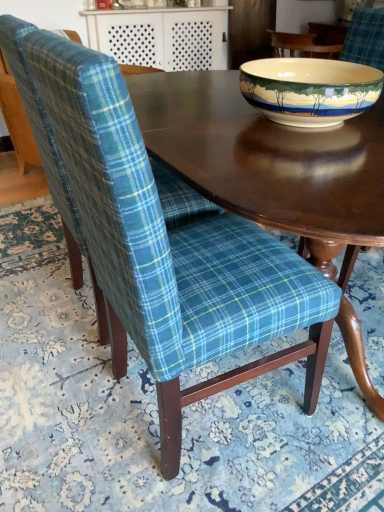
The image size is (384, 512). What are the coordinates of `smooth dark wood table at upper center` in the screenshot? It's located at (162, 37).

This screenshot has width=384, height=512. What do you see at coordinates (309, 90) in the screenshot?
I see `porcelain bowl at upper right` at bounding box center [309, 90].

Find the location of a particular element. teal plaid fabric chair at center, marked as the first chair in a front-to-back arrangement is located at coordinates (170, 251).

Based on the photo, is teal plaid fabric chair at center, marked as the first chair in a front-to-back arrangement, taller or shorter than smooth dark wood table at upper center?

Considering their sizes, teal plaid fabric chair at center, marked as the first chair in a front-to-back arrangement, has more height than smooth dark wood table at upper center.

Considering the sizes of teal plaid fabric chair at center, marked as the first chair in a front-to-back arrangement, and smooth dark wood table at upper center in the image, is teal plaid fabric chair at center, marked as the first chair in a front-to-back arrangement, wider or thinner than smooth dark wood table at upper center?

Clearly, teal plaid fabric chair at center, marked as the first chair in a front-to-back arrangement, has more width compared to smooth dark wood table at upper center.

Can you confirm if teal plaid fabric chair at center, the second chair in the back-to-front sequence, is positioned to the left of smooth dark wood table at upper center?

Incorrect, teal plaid fabric chair at center, the second chair in the back-to-front sequence, is not on the left side of smooth dark wood table at upper center.

Is porcelain bowl at upper right closer to the viewer compared to blue plaid fabric chair at left, the 1th chair positioned from the back?

No, it is behind blue plaid fabric chair at left, the 1th chair positioned from the back.

Is porcelain bowl at upper right not within blue plaid fabric chair at left, the second chair positioned from the front?

Yes, porcelain bowl at upper right is not within blue plaid fabric chair at left, the second chair positioned from the front.

Is porcelain bowl at upper right at the left side of blue plaid fabric chair at left, the 1th chair positioned from the back?

No.

Between point (285, 86) and point (70, 198), which one is positioned behind?

The point (70, 198) is farther from the camera.

Would you say smooth dark wood table at upper center is a long distance from porcelain bowl at upper right?

smooth dark wood table at upper center is positioned a significant distance from porcelain bowl at upper right.

Does smooth dark wood table at upper center contain porcelain bowl at upper right?

No, porcelain bowl at upper right is not surrounded by smooth dark wood table at upper center.

Which object is more forward, smooth dark wood table at upper center or porcelain bowl at upper right?

porcelain bowl at upper right is more forward.

From a real-world perspective, between blue plaid fabric chair at left, the 1th chair positioned from the back, and teal plaid fabric chair at center, marked as the first chair in a front-to-back arrangement, who is vertically higher?

From a 3D spatial view, teal plaid fabric chair at center, marked as the first chair in a front-to-back arrangement, is above.

Between blue plaid fabric chair at left, the 1th chair positioned from the back, and teal plaid fabric chair at center, the second chair in the back-to-front sequence, which one has less height?

With less height is teal plaid fabric chair at center, the second chair in the back-to-front sequence.

Is blue plaid fabric chair at left, the 1th chair positioned from the back, outside of teal plaid fabric chair at center, the second chair in the back-to-front sequence?

Yes, blue plaid fabric chair at left, the 1th chair positioned from the back, is outside of teal plaid fabric chair at center, the second chair in the back-to-front sequence.

Between blue plaid fabric chair at left, the 1th chair positioned from the back, and teal plaid fabric chair at center, the second chair in the back-to-front sequence, which one has smaller size?

teal plaid fabric chair at center, the second chair in the back-to-front sequence.

Considering the relative sizes of smooth dark wood table at upper center and teal plaid fabric chair at center, marked as the first chair in a front-to-back arrangement, in the image provided, is smooth dark wood table at upper center smaller than teal plaid fabric chair at center, marked as the first chair in a front-to-back arrangement,?

No.

Between smooth dark wood table at upper center and teal plaid fabric chair at center, the second chair in the back-to-front sequence, which one appears on the right side from the viewer's perspective?

Positioned to the right is teal plaid fabric chair at center, the second chair in the back-to-front sequence.

Does smooth dark wood table at upper center turn towards teal plaid fabric chair at center, marked as the first chair in a front-to-back arrangement?

Yes, smooth dark wood table at upper center faces towards teal plaid fabric chair at center, marked as the first chair in a front-to-back arrangement.

Image resolution: width=384 pixels, height=512 pixels. There is a teal plaid fabric chair at center, marked as the first chair in a front-to-back arrangement. What are the coordinates of `table above it (from a real-world perspective)` in the screenshot? It's located at (162, 37).

From a real-world perspective, is porcelain bowl at upper right physically located above or below smooth dark wood table at upper center?

Clearly, from a real-world perspective, porcelain bowl at upper right is above smooth dark wood table at upper center.

The image size is (384, 512). There is a smooth dark wood table at upper center. What are the coordinates of `bowl above it (from a real-world perspective)` in the screenshot? It's located at (309, 90).

How far apart are porcelain bowl at upper right and smooth dark wood table at upper center?

porcelain bowl at upper right is 7.03 feet from smooth dark wood table at upper center.

Does point (284, 83) appear closer or farther from the camera than point (167, 10)?

Point (284, 83) appears to be closer to the viewer than point (167, 10).

Based on the photo, which is further, [208,208] or [362,80]?

The point [208,208] is farther from the camera.

From the image's perspective, is blue plaid fabric chair at left, the 1th chair positioned from the back, positioned above or below porcelain bowl at upper right?

blue plaid fabric chair at left, the 1th chair positioned from the back, is situated lower than porcelain bowl at upper right in the image.

Considering the sizes of objects blue plaid fabric chair at left, the second chair positioned from the front, and porcelain bowl at upper right in the image provided, who is smaller, blue plaid fabric chair at left, the second chair positioned from the front, or porcelain bowl at upper right?

porcelain bowl at upper right is smaller.

Is blue plaid fabric chair at left, the second chair positioned from the front, wider than porcelain bowl at upper right?

Yes.

From the smooth dark wood table at upper center, count 2nd chair to the right and point to it. Please provide its 2D coordinates.

[(170, 251)]

I want to click on chair that is the 1st one when counting forward from the porcelain bowl at upper right, so click(x=40, y=125).

Based on their spatial positions, is blue plaid fabric chair at left, the 1th chair positioned from the back, or teal plaid fabric chair at center, the second chair in the back-to-front sequence, further from porcelain bowl at upper right?

blue plaid fabric chair at left, the 1th chair positioned from the back.

From the image, which object appears to be farther from smooth dark wood table at upper center, porcelain bowl at upper right or blue plaid fabric chair at left, the 1th chair positioned from the back?

porcelain bowl at upper right is positioned further to the anchor smooth dark wood table at upper center.

Looking at the image, which one is located closer to smooth dark wood table at upper center, teal plaid fabric chair at center, marked as the first chair in a front-to-back arrangement, or porcelain bowl at upper right?

The object closer to smooth dark wood table at upper center is porcelain bowl at upper right.

Looking at the image, which one is located further to teal plaid fabric chair at center, marked as the first chair in a front-to-back arrangement, smooth dark wood table at upper center or porcelain bowl at upper right?

The object further to teal plaid fabric chair at center, marked as the first chair in a front-to-back arrangement, is smooth dark wood table at upper center.

Based on their spatial positions, is blue plaid fabric chair at left, the second chair positioned from the front, or porcelain bowl at upper right further from smooth dark wood table at upper center?

porcelain bowl at upper right is positioned further to the anchor smooth dark wood table at upper center.

From the image, which object appears to be nearer to blue plaid fabric chair at left, the second chair positioned from the front, smooth dark wood table at upper center or porcelain bowl at upper right?

porcelain bowl at upper right is closer to blue plaid fabric chair at left, the second chair positioned from the front.

When comparing their distances from porcelain bowl at upper right, does teal plaid fabric chair at center, marked as the first chair in a front-to-back arrangement, or blue plaid fabric chair at left, the second chair positioned from the front, seem further?

blue plaid fabric chair at left, the second chair positioned from the front.

From the picture: Looking at the image, which one is located closer to blue plaid fabric chair at left, the second chair positioned from the front, porcelain bowl at upper right or teal plaid fabric chair at center, marked as the first chair in a front-to-back arrangement?

Among the two, teal plaid fabric chair at center, marked as the first chair in a front-to-back arrangement, is located nearer to blue plaid fabric chair at left, the second chair positioned from the front.

Locate an element on the screen. The height and width of the screenshot is (512, 384). chair between blue plaid fabric chair at left, the 1th chair positioned from the back, and porcelain bowl at upper right, in the horizontal direction is located at coordinates (170, 251).

Where is `bowl between blue plaid fabric chair at left, the second chair positioned from the front, and smooth dark wood table at upper center in the front-back direction`? The image size is (384, 512). bowl between blue plaid fabric chair at left, the second chair positioned from the front, and smooth dark wood table at upper center in the front-back direction is located at coordinates tap(309, 90).

Identify the location of chair between teal plaid fabric chair at center, marked as the first chair in a front-to-back arrangement, and smooth dark wood table at upper center in the front-back direction. This screenshot has height=512, width=384. (40, 125).

At what (x,y) coordinates should I click in order to perform the action: click on bowl between teal plaid fabric chair at center, the second chair in the back-to-front sequence, and smooth dark wood table at upper center from front to back. Please return your answer as a coordinate pair (x, y). Looking at the image, I should click on (309, 90).